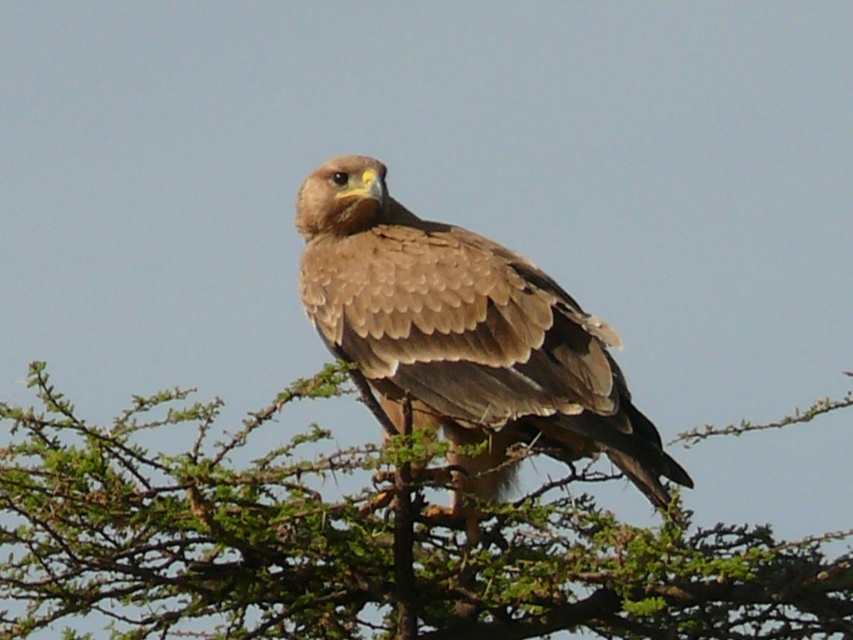
You are a birdwatcher observing the scene. You notice the green leafy tree at center and the brown feathered eagle at center. Which object is located below the other?

The green leafy tree at center is positioned under the brown feathered eagle at center, so the tree is below the eagle.

You are standing at the origin point in the scene. Which direction should you move to approach the green leafy tree at center?

The green leafy tree at center is located at point 0.855 on the x and 0.423 on the y. Since you are at the origin, you should move towards the right and slightly forward to reach the tree.

You are an ornithologist observing the brown feathered eagle at center perched on the green leafy tree at center. Can you determine if the tree is taller than the eagle?

The green leafy tree at center is shorter than the brown feathered eagle at center, so the tree is not taller than the eagle.